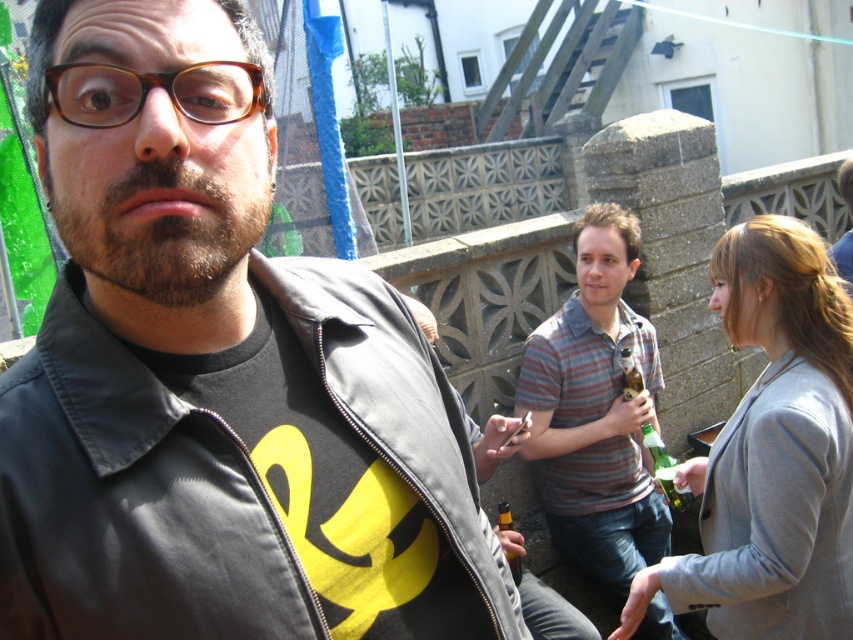
Question: Among these objects, which one is nearest to the camera?

Choices:
 (A) gray fabric jacket at right
 (B) matte black jacket at center
 (C) translucent glass bottle at center

Answer: (B)

Question: Is gray fabric jacket at right thinner than striped cotton shirt at center?

Choices:
 (A) yes
 (B) no

Answer: (A)

Question: Which of the following is the farthest from the observer?

Choices:
 (A) (844, 483)
 (B) (425, 470)

Answer: (A)

Question: Among these objects, which one is nearest to the camera?

Choices:
 (A) striped cotton shirt at center
 (B) translucent glass bottle at center
 (C) gray fabric jacket at right
 (D) matte black jacket at center

Answer: (D)

Question: Is matte black jacket at center wider than striped cotton shirt at center?

Choices:
 (A) yes
 (B) no

Answer: (B)

Question: Where is matte black jacket at center located in relation to translucent glass bottle at center in the image?

Choices:
 (A) below
 (B) above

Answer: (B)